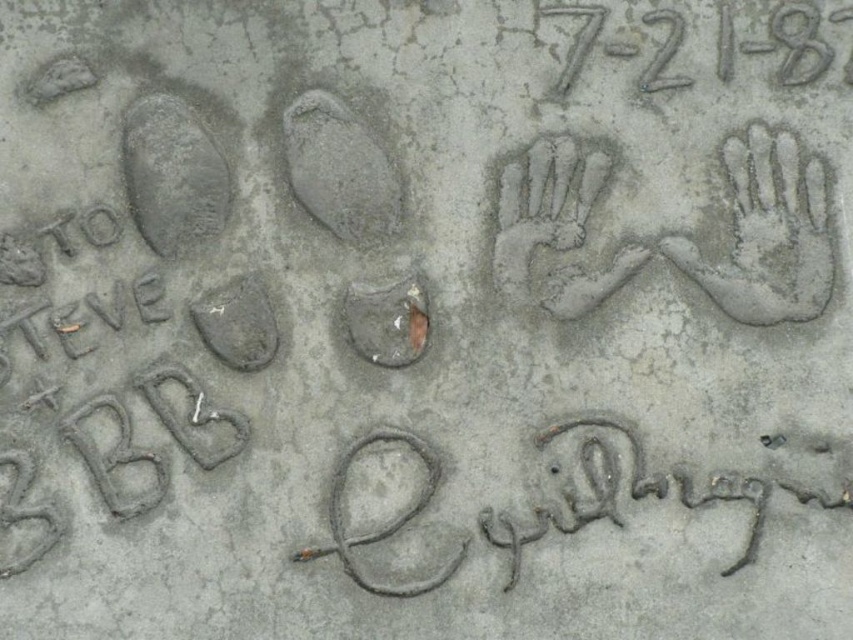
Question: Which point appears closest to the camera in this image?

Choices:
 (A) (206, 216)
 (B) (416, 308)
 (C) (350, 147)
 (D) (221, 310)

Answer: (D)

Question: Is gray concrete footprint at upper left to the left of smooth concrete footprint at center from the viewer's perspective?

Choices:
 (A) no
 (B) yes

Answer: (B)

Question: Estimate the real-world distances between objects in this image. Which object is closer to the gray concrete footprint at center-left?

Choices:
 (A) gray concrete footprint at upper left
 (B) gray concrete footprint at center

Answer: (A)

Question: Among these objects, which one is nearest to the camera?

Choices:
 (A) gray concrete footprint at center-left
 (B) smooth concrete footprint at center

Answer: (A)

Question: Does gray concrete footprint at upper left appear under gray concrete footprint at center?

Choices:
 (A) no
 (B) yes

Answer: (A)

Question: Is gray concrete footprint at center positioned in front of gray concrete footprint at center-left?

Choices:
 (A) yes
 (B) no

Answer: (B)